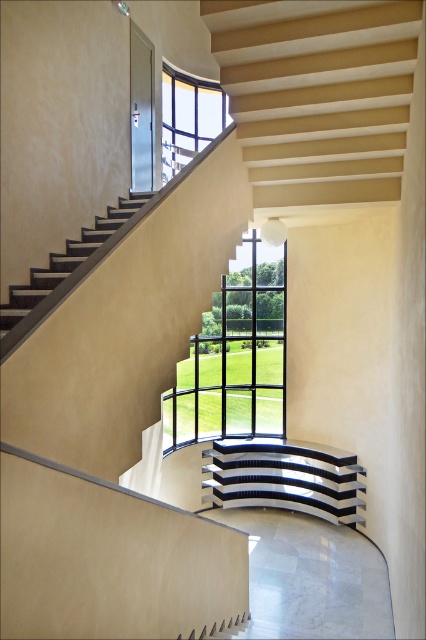
What do you see at coordinates (235, 355) in the screenshot?
I see `black glass window at center` at bounding box center [235, 355].

Can you confirm if black glass window at center is thinner than clear glass window at upper center?

No.

What are the coordinates of `black glass window at center` in the screenshot? It's located at (235, 355).

Is polished chrome stair at center shorter than clear glass window at upper center?

Yes.

Which is in front, point (310, 467) or point (181, 134)?

Point (310, 467) is more forward.

Is point (273, 451) in front of point (183, 83)?

No, it is not.

Where is `polished chrome stair at center`? The image size is (426, 640). polished chrome stair at center is located at coordinates (284, 477).

Is black glass window at center in front of polished chrome stair at center?

No.

From the picture: Who is more distant from viewer, [221,428] or [215,465]?

Positioned behind is point [221,428].

Does point (236, 308) come behind point (229, 497)?

Yes, point (236, 308) is behind point (229, 497).

You are a GUI agent. You are given a task and a screenshot of the screen. Output one action in this format:
    pyautogui.click(x=<x>, y=<y>)
    Task: Click on the black glass window at center
    This screenshot has width=426, height=640.
    Given the screenshot: What is the action you would take?
    pyautogui.click(x=235, y=355)